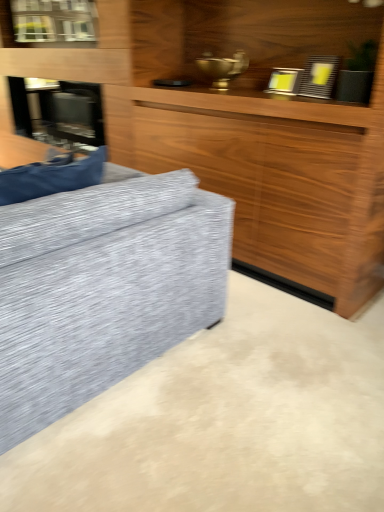
Question: From the image's perspective, is wooden cabinet at center above or below clear glass window at upper left?

Choices:
 (A) below
 (B) above

Answer: (A)

Question: Is wooden cabinet at center spatially inside clear glass window at upper left, or outside of it?

Choices:
 (A) inside
 (B) outside

Answer: (B)

Question: Which of these objects is positioned closest to the wooden cabinet at center?

Choices:
 (A) stainless steel fireplace at left
 (B) clear glass window at upper left

Answer: (A)

Question: Estimate the real-world distances between objects in this image. Which object is closer to the clear glass window at upper left?

Choices:
 (A) stainless steel fireplace at left
 (B) wooden cabinet at center

Answer: (A)